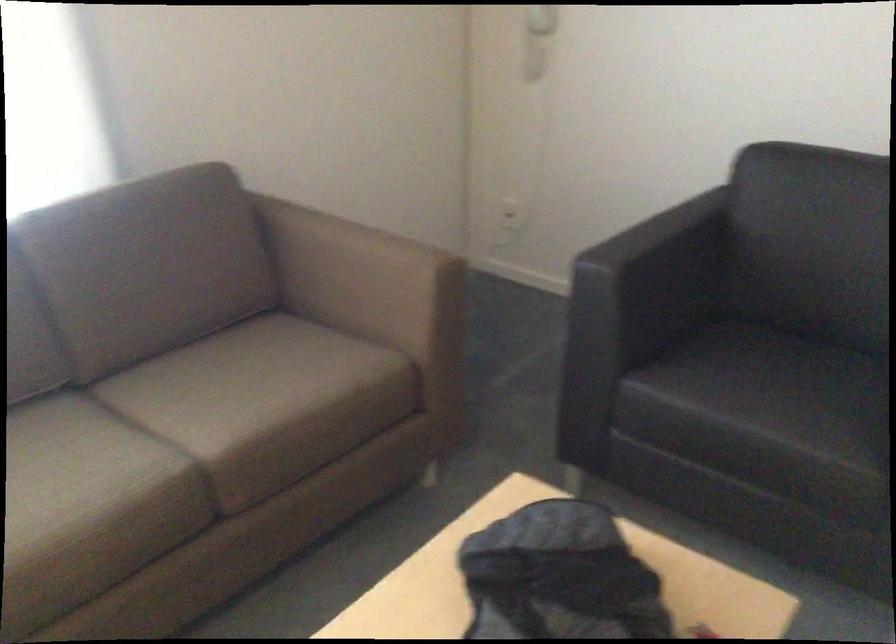
This screenshot has height=644, width=896. What are the coordinates of `brown sofa sitting surface` in the screenshot? It's located at (179, 451).